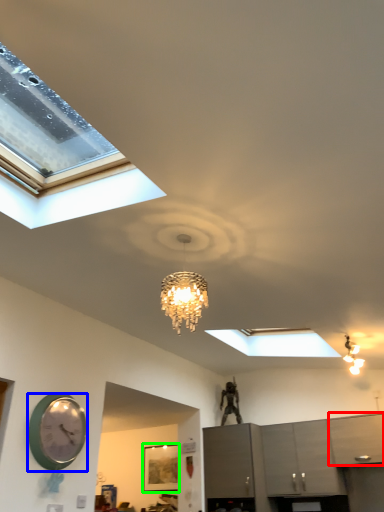
Question: Estimate the real-world distances between objects in this image. Which object is closer to cabinetry (highlighted by a red box), wall clock (highlighted by a blue box) or picture frame (highlighted by a green box)?

Choices:
 (A) wall clock
 (B) picture frame

Answer: (B)